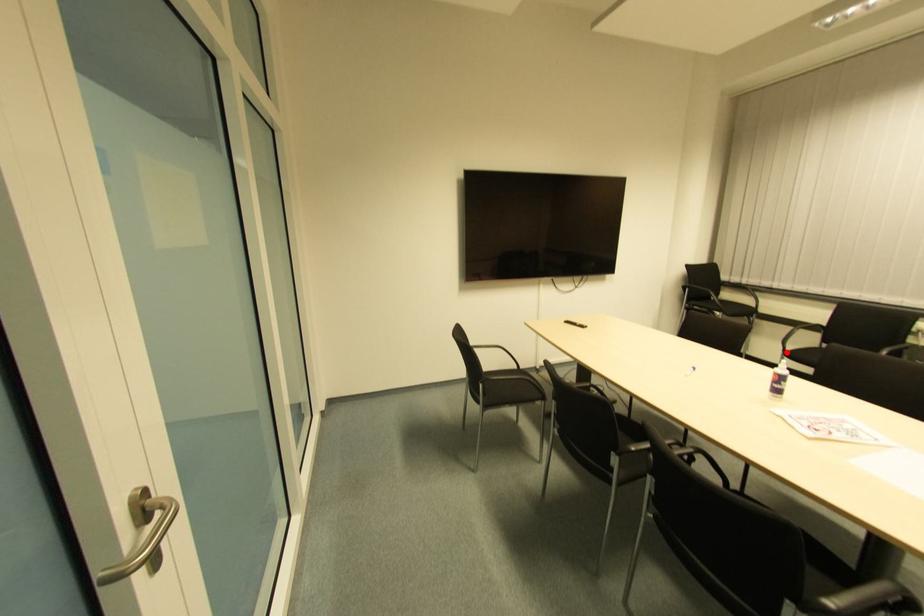
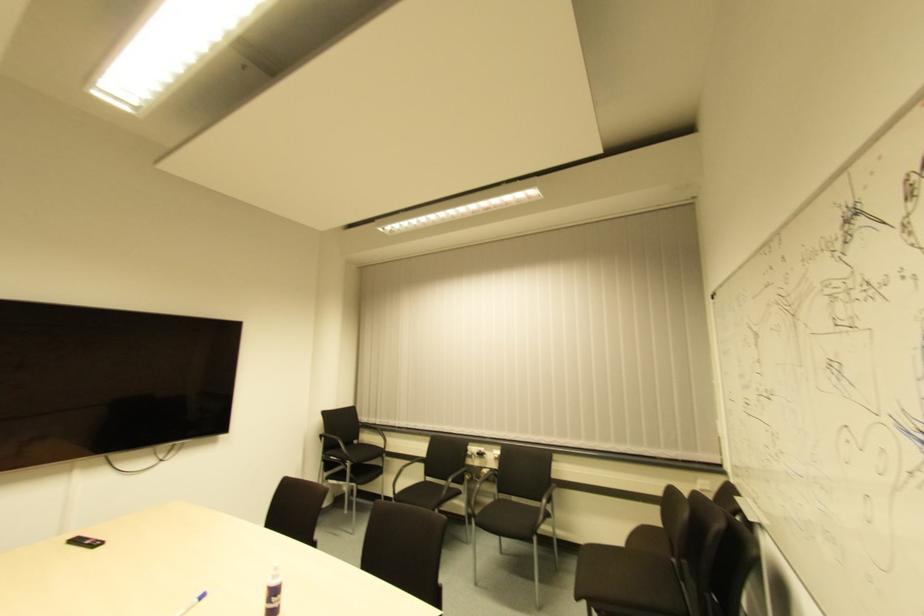
Question: A red point is marked in image1. In image2, is the corresponding 3D point closer to the camera or farther? Reply with the corresponding letter.

Choices:
 (A) The corresponding 3D point is closer.
 (B) The corresponding 3D point is farther.

Answer: (B)